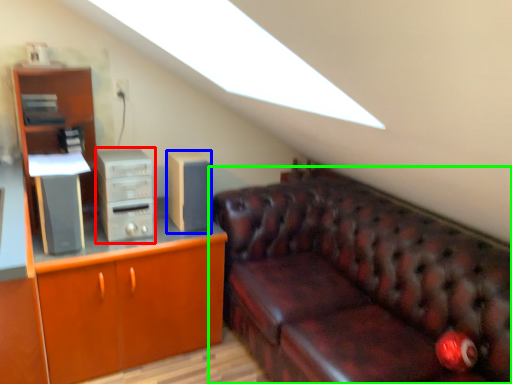
Question: Based on their relative distances, which object is nearer to computer tower (highlighted by a red box)? Choose from speaker (highlighted by a blue box) and studio couch (highlighted by a green box).

Choices:
 (A) speaker
 (B) studio couch

Answer: (A)